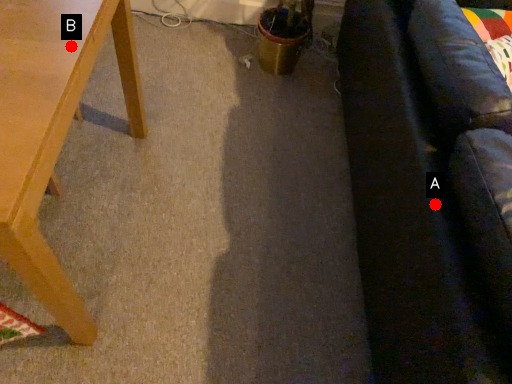
Question: Two points are circled on the image, labeled by A and B beside each circle. Which point is further to the camera?

Choices:
 (A) A is further
 (B) B is further

Answer: (B)